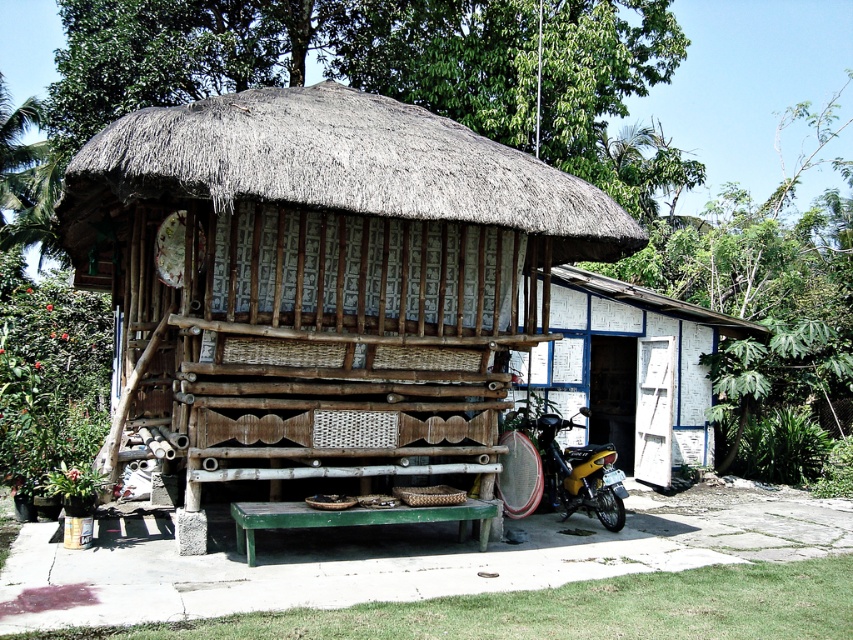
Question: Based on their relative distances, which object is nearer to the white painted wood at right?

Choices:
 (A) yellow matte motorcycle at lower right
 (B) brown thatch at center

Answer: (A)

Question: Is bamboo hut at center to the left of brown thatch at center from the viewer's perspective?

Choices:
 (A) no
 (B) yes

Answer: (B)

Question: Does brown thatch at center have a larger size compared to white painted wood at right?

Choices:
 (A) yes
 (B) no

Answer: (A)

Question: Is bamboo hut at center thinner than brown thatch at center?

Choices:
 (A) yes
 (B) no

Answer: (A)

Question: Which of these objects is positioned farthest from the yellow matte motorcycle at lower right?

Choices:
 (A) white painted wood at right
 (B) bamboo hut at center
 (C) brown thatch at center

Answer: (C)

Question: Which object is farther from the camera taking this photo?

Choices:
 (A) bamboo hut at center
 (B) yellow matte motorcycle at lower right
 (C) brown thatch at center
 (D) white painted wood at right

Answer: (D)